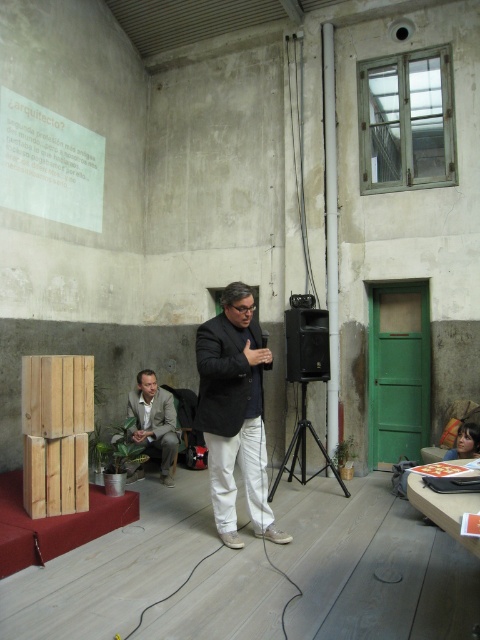
Is light brown fabric suit at lower left further to camera compared to black metal tripod at center?

Yes.

What do you see at coordinates (154, 420) in the screenshot? Image resolution: width=480 pixels, height=640 pixels. I see `light brown fabric suit at lower left` at bounding box center [154, 420].

Where is `light brown fabric suit at lower left`? The image size is (480, 640). light brown fabric suit at lower left is located at coordinates (154, 420).

Does black matte speaker at center appear under black metal tripod at center?

Actually, black matte speaker at center is above black metal tripod at center.

What do you see at coordinates (307, 344) in the screenshot? I see `black matte speaker at center` at bounding box center [307, 344].

You are a GUI agent. You are given a task and a screenshot of the screen. Output one action in this format:
    pyautogui.click(x=<x>, y=<y>)
    Task: Click on the black matte speaker at center
    Image resolution: width=480 pixels, height=640 pixels.
    Given the screenshot: What is the action you would take?
    pyautogui.click(x=307, y=344)

Is matte black suit at center to the left of black metal tripod at center from the viewer's perspective?

Indeed, matte black suit at center is positioned on the left side of black metal tripod at center.

Does matte black suit at center have a greater width compared to black metal tripod at center?

No, matte black suit at center is not wider than black metal tripod at center.

The image size is (480, 640). Describe the element at coordinates (235, 413) in the screenshot. I see `matte black suit at center` at that location.

Where is `matte black suit at center`? The height and width of the screenshot is (640, 480). matte black suit at center is located at coordinates (235, 413).